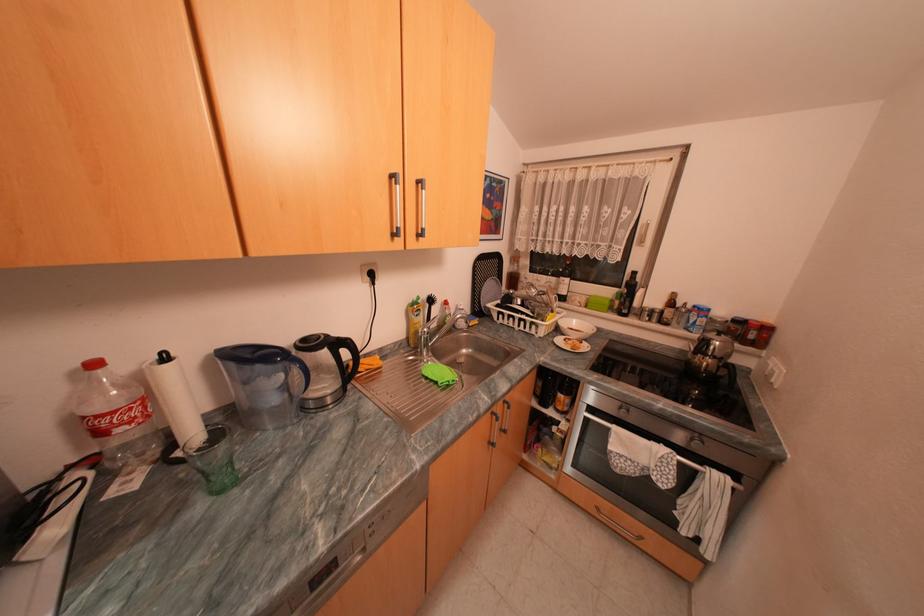
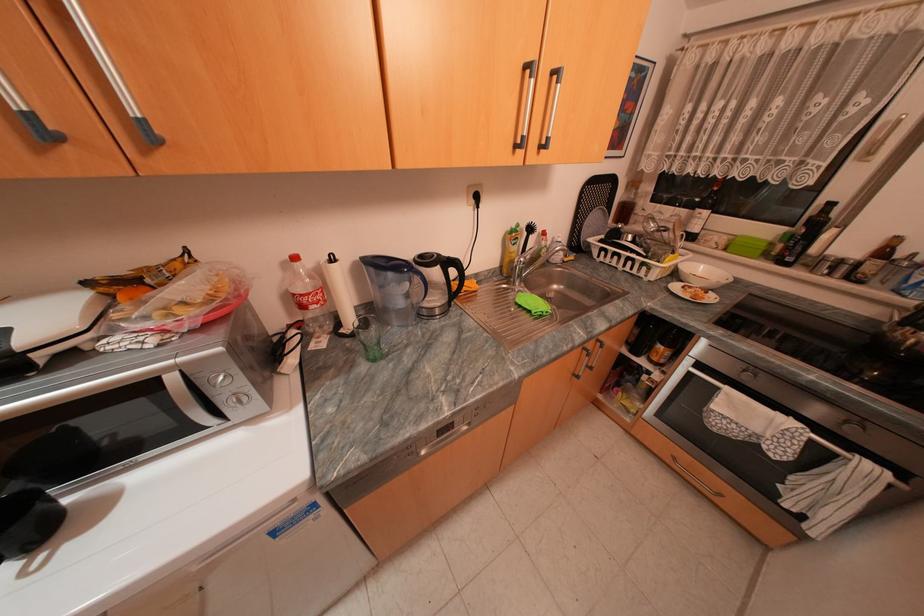
Locate, in the second image, the point that corresponds to the point at 563,278 in the first image.

(694, 209)